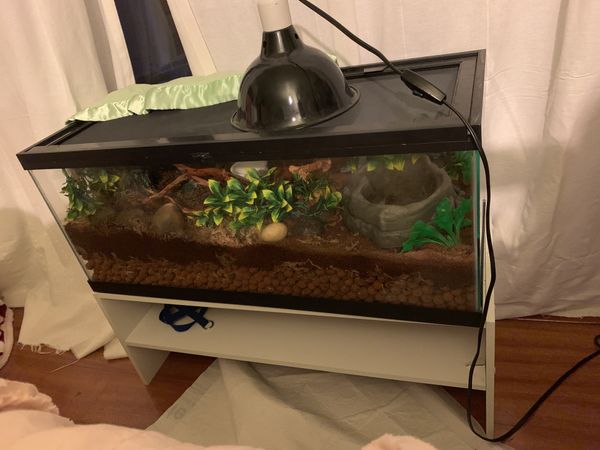
Where is `curtain`? The height and width of the screenshot is (450, 600). curtain is located at coordinates (541, 40).